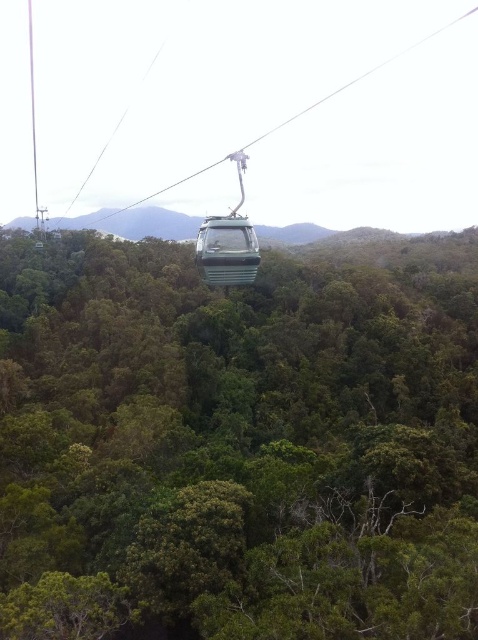
Which is in front, point (150, 316) or point (215, 161)?

Point (150, 316) is more forward.

Who is positioned more to the left, green leafy tree at center or metallic green gondola at center?

metallic green gondola at center is more to the left.

Is point (335, 532) positioned before point (104, 236)?

Yes.

Find the location of a particular element. The width and height of the screenshot is (478, 640). green leafy tree at center is located at coordinates (238, 442).

Is metallic green gondola at center wider than metallic green cable car at center?

Correct, the width of metallic green gondola at center exceeds that of metallic green cable car at center.

Between metallic green gondola at center and metallic green cable car at center, which one appears on the left side from the viewer's perspective?

metallic green gondola at center is more to the left.

Locate an element on the screen. This screenshot has height=640, width=478. metallic green gondola at center is located at coordinates (361, 76).

Can you confirm if green leafy tree at center is positioned to the right of metallic green cable car at center?

In fact, green leafy tree at center is to the left of metallic green cable car at center.

Is point (143, 556) in front of point (220, 243)?

No, (143, 556) is further to viewer.

Which is behind, point (36, 298) or point (242, 244)?

Positioned behind is point (36, 298).

Identify the location of green leafy tree at center. This screenshot has height=640, width=478. (238, 442).